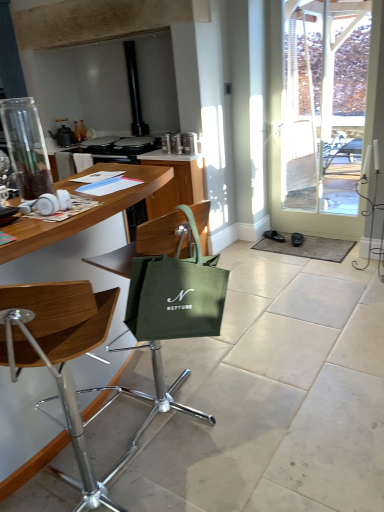
What are the coordinates of `unoccupied region to the right of wooden at left, arranged as the first chair when viewed from the front` in the screenshot? It's located at (203, 474).